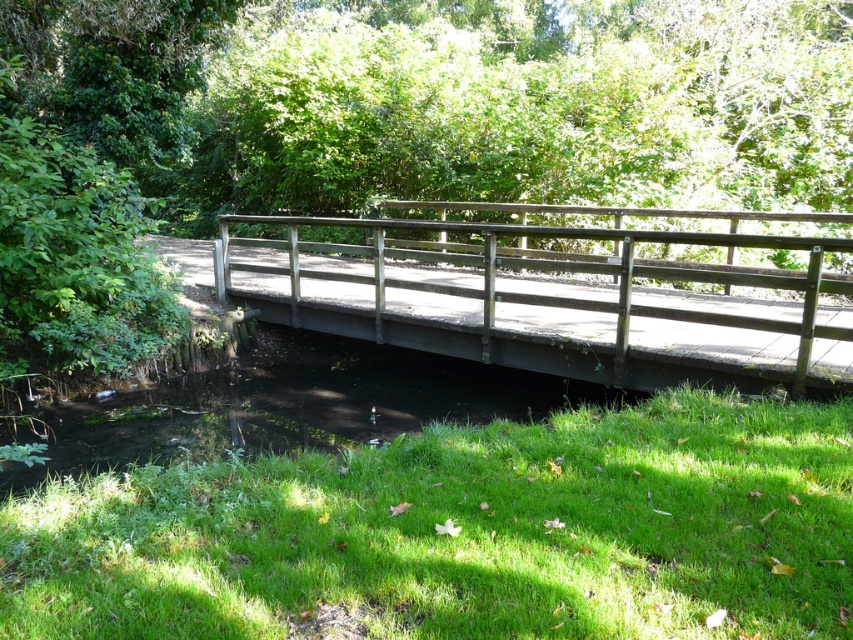
Question: Is green grass at lower center positioned before wooden bridge at center?

Choices:
 (A) yes
 (B) no

Answer: (A)

Question: Does green grass at lower center have a lesser width compared to wooden bridge at center?

Choices:
 (A) no
 (B) yes

Answer: (B)

Question: Which point appears closest to the camera in this image?

Choices:
 (A) (165, 582)
 (B) (184, 150)

Answer: (A)

Question: Which point is farther from the camera taking this photo?

Choices:
 (A) (695, 212)
 (B) (392, 600)
 (C) (697, 109)

Answer: (C)

Question: Considering the real-world distances, which object is closest to the wooden bridge at center?

Choices:
 (A) green leafy tree at center
 (B) green grass at lower center

Answer: (A)

Question: Does green leafy tree at center come behind wooden bridge at center?

Choices:
 (A) yes
 (B) no

Answer: (A)